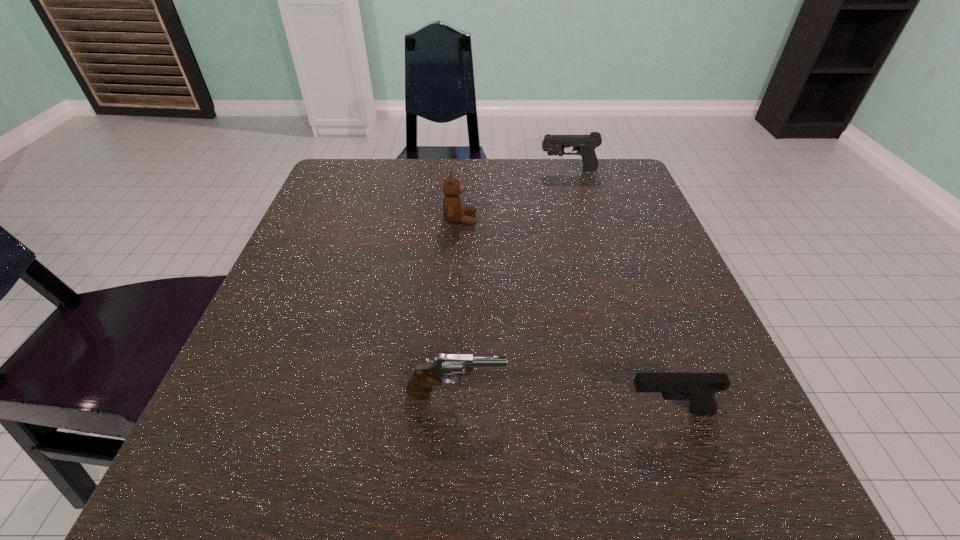
In the image, there is a desktop. At what (x,y) coordinates should I click in order to perform the action: click on vacant space at the far left corner. Please return your answer as a coordinate pair (x, y). This screenshot has height=540, width=960. Looking at the image, I should click on (363, 170).

Where is `free space at the far right corner of the desktop`? The image size is (960, 540). free space at the far right corner of the desktop is located at coordinates (567, 186).

This screenshot has height=540, width=960. Identify the location of vacant region between the second nearest pistol and the teddy bear. (458, 307).

In order to click on unoccupied position between the farthest object and the second nearest object in this screenshot , I will do `click(513, 282)`.

At what (x,y) coordinates should I click in order to perform the action: click on free space between the nearest object and the teddy bear. Please return your answer as a coordinate pair (x, y). The width and height of the screenshot is (960, 540). Looking at the image, I should click on (564, 315).

Find the location of `empty space that is in between the leftmost pistol and the nearest pistol`. empty space that is in between the leftmost pistol and the nearest pistol is located at coordinates (563, 402).

Where is `vacant space that's between the nearest pistol and the farthest pistol`? This screenshot has width=960, height=540. vacant space that's between the nearest pistol and the farthest pistol is located at coordinates click(618, 291).

Image resolution: width=960 pixels, height=540 pixels. I want to click on blank region between the leftmost pistol and the third nearest object, so click(458, 307).

Locate an element on the screen. The image size is (960, 540). free space between the farthest pistol and the second nearest pistol is located at coordinates (513, 282).

Identify the location of free space between the second nearest object and the nearest pistol. (563, 402).